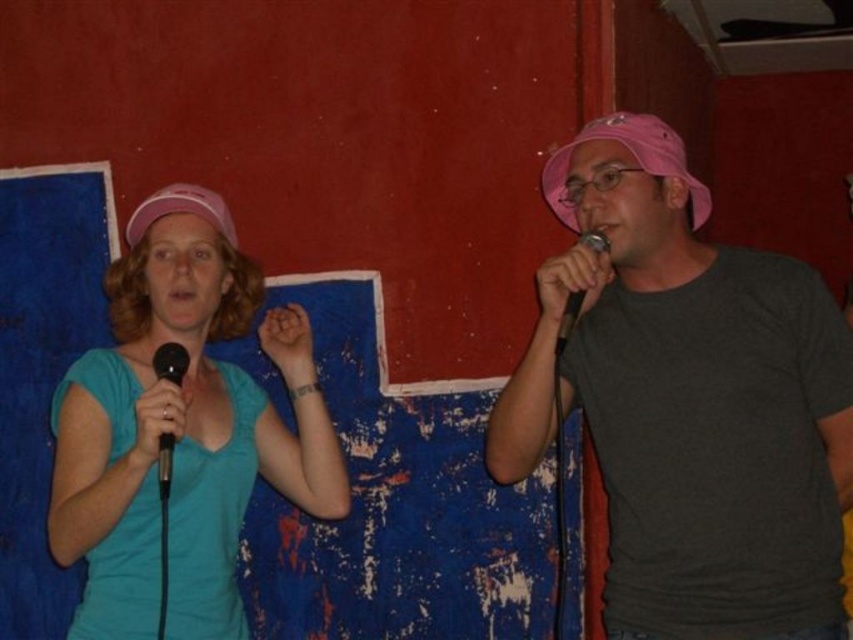
Question: Which object is positioned farthest from the black matte microphone at left?

Choices:
 (A) pink matte cap at upper left
 (B) pink fabric hat at center

Answer: (B)

Question: Is teal matte shirt at left smaller than matte pink cap at upper center?

Choices:
 (A) yes
 (B) no

Answer: (B)

Question: In this image, where is teal matte shirt at left located relative to black matte microphone at right?

Choices:
 (A) below
 (B) above

Answer: (A)

Question: Which point is closer to the camera taking this photo?

Choices:
 (A) (607, 221)
 (B) (161, 442)
 (C) (196, 320)

Answer: (B)

Question: Can you confirm if pink fabric hat at center is smaller than black matte microphone at right?

Choices:
 (A) no
 (B) yes

Answer: (A)

Question: Which of the following is the farthest from the observer?

Choices:
 (A) (165, 492)
 (B) (173, 310)
 (C) (202, 410)

Answer: (C)